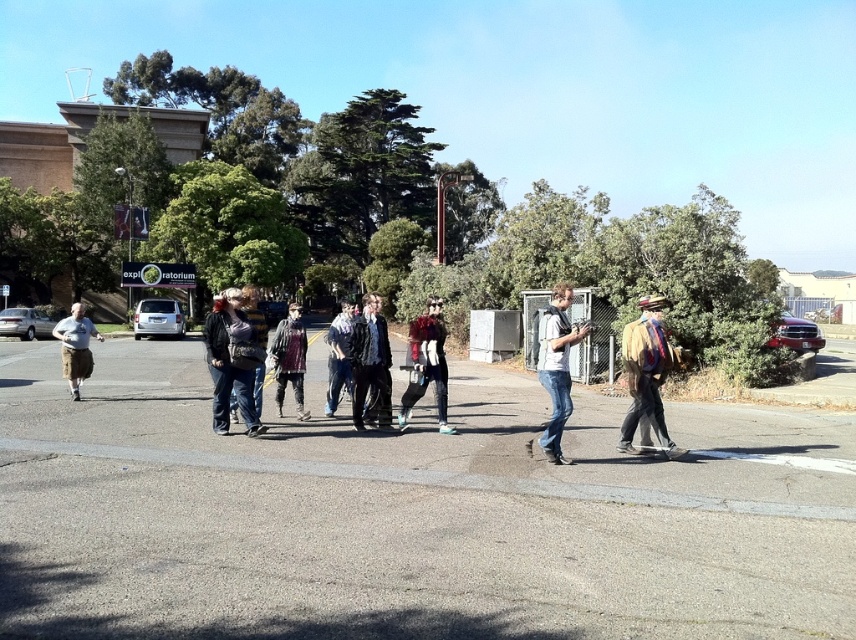
Question: Among these objects, which one is farthest from the camera?

Choices:
 (A) denim jeans at center
 (B) distressed denim jacket at center
 (C) brown leather jacket at center

Answer: (B)

Question: Which of the following is the closest to the observer?

Choices:
 (A) distressed denim jacket at center
 (B) denim jeans at center

Answer: (B)

Question: Is brown leather jacket at center wider than distressed denim jacket at center?

Choices:
 (A) yes
 (B) no

Answer: (B)

Question: Can you confirm if brown leather jacket at center is bigger than distressed denim jacket at center?

Choices:
 (A) no
 (B) yes

Answer: (A)

Question: Can you confirm if brown leather jacket at center is positioned below denim jeans at center?

Choices:
 (A) no
 (B) yes

Answer: (B)

Question: Which point appears closest to the camera in this image?

Choices:
 (A) (277, 337)
 (B) (657, 328)
 (C) (557, 413)

Answer: (C)